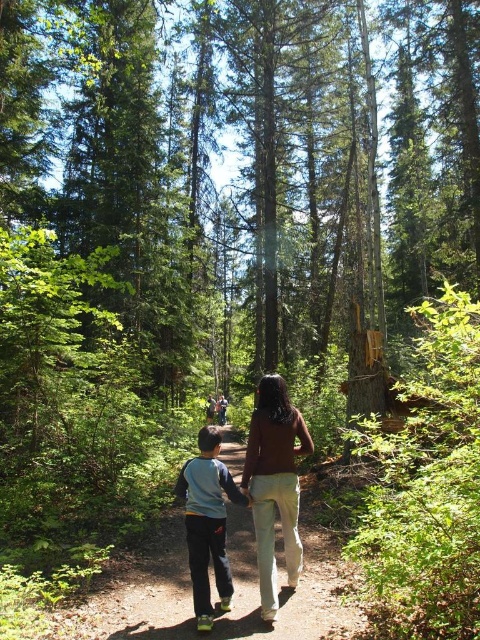
Question: Estimate the real-world distances between objects in this image. Which object is closer to the dirt path at center?

Choices:
 (A) brown matte shirt at center
 (B) light blue fleece at center

Answer: (A)

Question: Which point is farther to the camera?

Choices:
 (A) brown matte shirt at center
 (B) dirt path at center

Answer: (B)

Question: Does brown matte shirt at center have a greater width compared to light blue fleece at center?

Choices:
 (A) no
 (B) yes

Answer: (A)

Question: Is dirt path at center wider than light blue fleece at center?

Choices:
 (A) no
 (B) yes

Answer: (A)

Question: Which object appears farthest from the camera in this image?

Choices:
 (A) brown matte shirt at center
 (B) light blue fleece at center

Answer: (A)

Question: Is dirt path at center positioned at the back of light blue fleece at center?

Choices:
 (A) yes
 (B) no

Answer: (A)